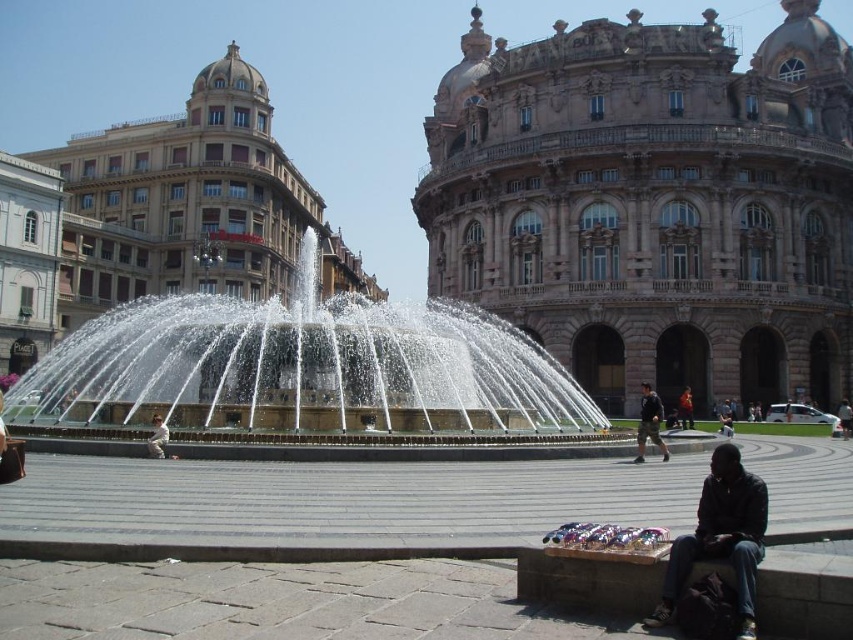
In the scene shown: You are standing in the square and want to take a photo of both the brown stone palace at upper center and the white fabric person at center in the same frame. Given that your camera has a maximum zoom range of 50 meters, will you be able to capture both subjects in a single photo?

The brown stone palace at upper center and white fabric person at center are 48.94 meters apart from each other. Since the distance between them is less than the camera maximum zoom range of 50 meters, you can capture both subjects in a single photo.

Looking at this image, you are a photographer trying to capture the entire brown stone building at center and the dark blue jeans at lower right in one frame. Given that the camera can only focus on objects within a 10 meter distance, will both objects be in focus?

The brown stone building at center is larger than the dark blue jeans at lower right, but the camera can focus on objects within 10 meters. However, since the question does not provide information about their actual distances from the camera, it is impossible to determine if both will be in focus based on size alone.

You are planning to take a photo of the brown stone palace at upper center and the white fabric person at center in the square. Which object should you focus on first if you want to capture both in a single frame without moving the camera?

You should focus on the brown stone palace at upper center first because it is larger in size than the white fabric person at center, making it the more prominent subject to include in the frame.